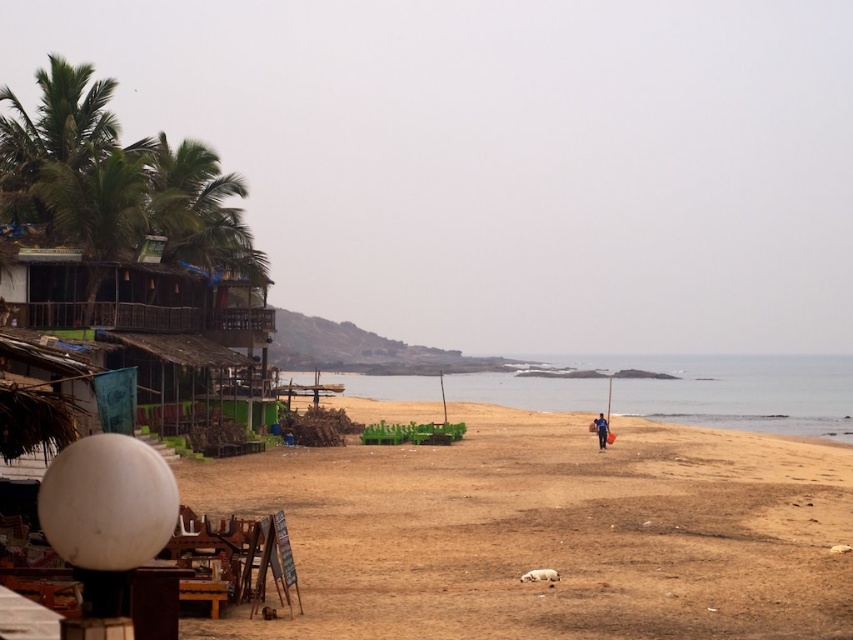
Looking at this image, who is lower down, clear blue water at center or green leafy palm tree at left?

clear blue water at center is lower down.

Is point (509, 387) less distant than point (88, 250)?

No, (509, 387) is behind (88, 250).

Is point (613, 403) farther from camera compared to point (117, 186)?

That is True.

Identify the location of clear blue water at center. The height and width of the screenshot is (640, 853). (737, 392).

From the picture: Which is below, green leafy palm tree at left or blue fabric bag at center?

→ blue fabric bag at center is below.

Is the position of green leafy palm tree at left more distant than that of blue fabric bag at center?

No, it is in front of blue fabric bag at center.

Locate an element on the screen. The width and height of the screenshot is (853, 640). green leafy palm tree at left is located at coordinates (96, 211).

Find the location of `green leafy palm tree at left`. green leafy palm tree at left is located at coordinates (96, 211).

Is wooden hut at left taller than clear blue water at center?

Correct, wooden hut at left is much taller as clear blue water at center.

Who is positioned more to the left, wooden hut at left or clear blue water at center?

Positioned to the left is wooden hut at left.

Which is behind, point (167, 372) or point (589, 387)?

Point (589, 387)

Identify the location of wooden hut at left. The width and height of the screenshot is (853, 640). (x=152, y=328).